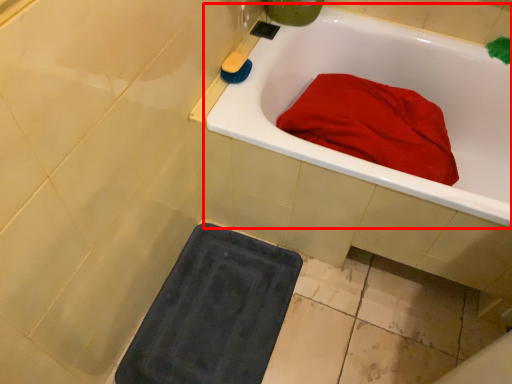
Question: From the image's perspective, what is the correct spatial relationship of bathtub (annotated by the red box) in relation to soap?

Choices:
 (A) above
 (B) below

Answer: (B)